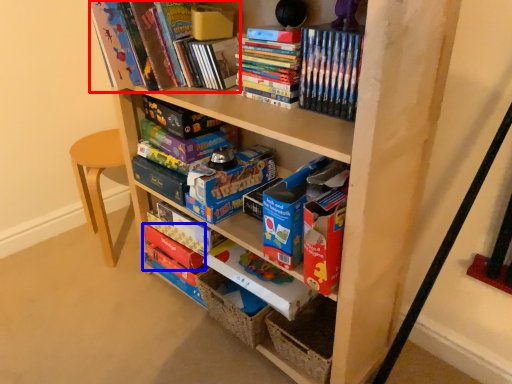
Question: Which of the following is the closest to the observer, book (highlighted by a red box) or paperback book (highlighted by a blue box)?

Choices:
 (A) book
 (B) paperback book

Answer: (A)